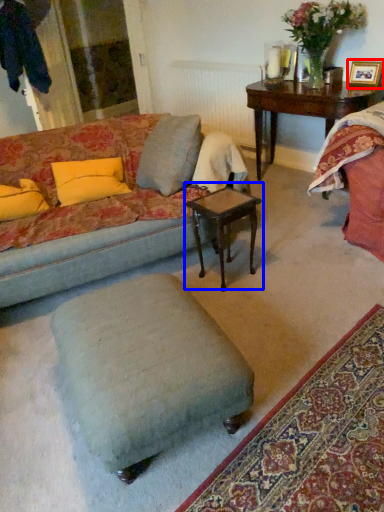
Question: Which point is further to the camera, picture frame (highlighted by a red box) or coffee table (highlighted by a blue box)?

Choices:
 (A) picture frame
 (B) coffee table

Answer: (A)